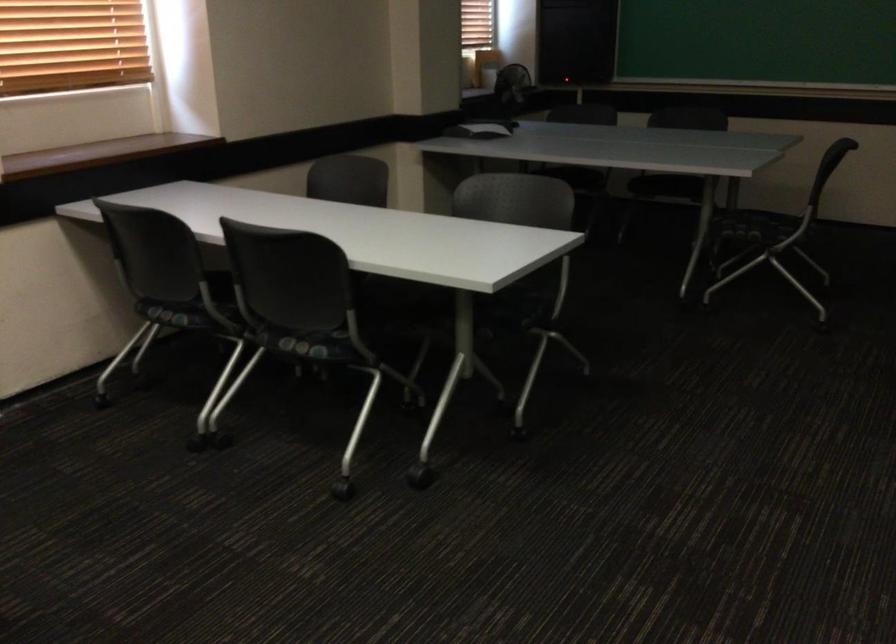
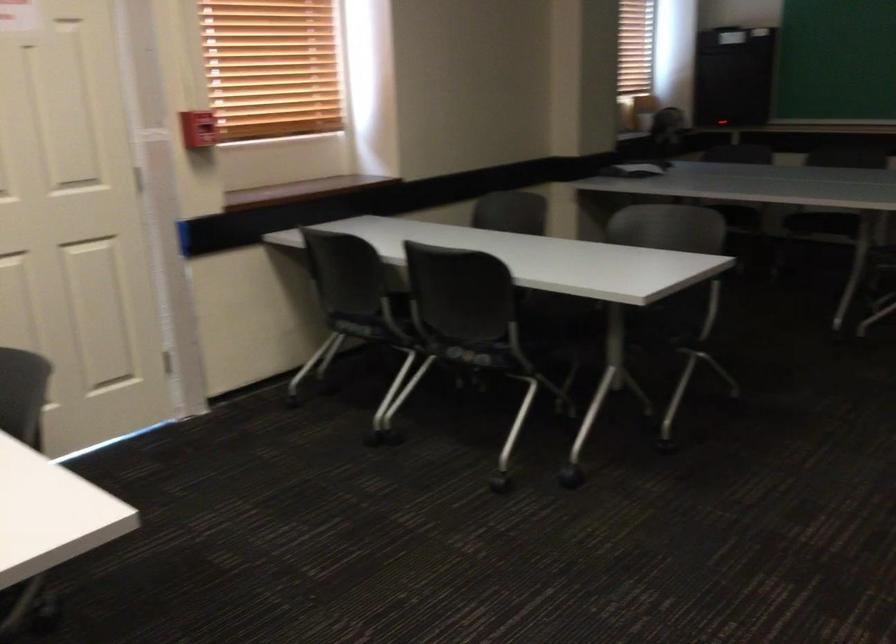
Find the pixel in the second image that matches [311,345] in the first image.

(474, 354)